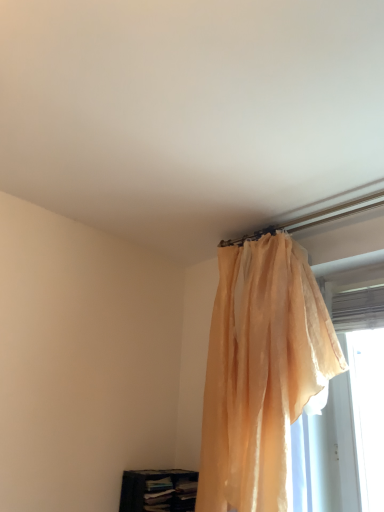
What do you see at coordinates (261, 373) in the screenshot? I see `translucent peach curtain at upper right` at bounding box center [261, 373].

Where is `dark blue fabric bookshelf at lower left`? This screenshot has width=384, height=512. dark blue fabric bookshelf at lower left is located at coordinates (158, 490).

Describe the element at coordinates (158, 490) in the screenshot. I see `dark blue fabric bookshelf at lower left` at that location.

Find the location of `translucent peach curtain at upper right`. translucent peach curtain at upper right is located at coordinates (261, 373).

From the image's perspective, which one is positioned lower, dark blue fabric bookshelf at lower left or translucent peach curtain at upper right?

dark blue fabric bookshelf at lower left is shown below in the image.

Is dark blue fabric bookshelf at lower left in contact with translucent peach curtain at upper right?

No, dark blue fabric bookshelf at lower left is not in contact with translucent peach curtain at upper right.

Is dark blue fabric bookshelf at lower left turned away from translucent peach curtain at upper right?

No, translucent peach curtain at upper right is not at the back of dark blue fabric bookshelf at lower left.

In order to click on furniture located below the translucent peach curtain at upper right (from the image's perspective) in this screenshot , I will do `click(158, 490)`.

Based on the photo, is translucent peach curtain at upper right placed right next to dark blue fabric bookshelf at lower left?

There is a gap between translucent peach curtain at upper right and dark blue fabric bookshelf at lower left.

Does point (241, 253) lie in front of point (190, 510)?

That is False.

Looking at this image, from the image's perspective, which is below, translucent peach curtain at upper right or dark blue fabric bookshelf at lower left?

From the image's view, dark blue fabric bookshelf at lower left is below.

Is translucent fabric at right oriented towards dark blue fabric bookshelf at lower left?

No, translucent fabric at right is not oriented towards dark blue fabric bookshelf at lower left.

Which is correct: translucent fabric at right is inside dark blue fabric bookshelf at lower left, or outside of it?

The correct answer is: outside.

From the image's perspective, is translucent fabric at right beneath dark blue fabric bookshelf at lower left?

Incorrect, from the image's perspective, translucent fabric at right is higher than dark blue fabric bookshelf at lower left.

Is translucent peach curtain at upper right completely or partially inside translucent fabric at right?

Actually, translucent peach curtain at upper right is outside translucent fabric at right.

Between translucent fabric at right and translucent peach curtain at upper right, which one appears on the right side from the viewer's perspective?

From the viewer's perspective, translucent fabric at right appears more on the right side.

Is translucent fabric at right in contact with translucent peach curtain at upper right?

No.

Could you tell me if translucent fabric at right is facing translucent peach curtain at upper right?

No, translucent fabric at right is not aimed at translucent peach curtain at upper right.

Is point (238, 270) positioned in front of point (348, 329)?

Yes, point (238, 270) is closer to viewer.

How many degrees apart are the facing directions of translucent peach curtain at upper right and translucent fabric at right?

2.58 degrees separate the facing orientations of translucent peach curtain at upper right and translucent fabric at right.

Is translucent peach curtain at upper right located outside translucent fabric at right?

translucent peach curtain at upper right lies outside translucent fabric at right's area.

Find the location of a particular element. This screenshot has height=512, width=384. curtain on the left of translucent fabric at right is located at coordinates (261, 373).

Is dark blue fabric bookshelf at lower left spatially inside translucent fabric at right, or outside of it?

dark blue fabric bookshelf at lower left is not inside translucent fabric at right, it's outside.

Who is smaller, dark blue fabric bookshelf at lower left or translucent fabric at right?

Smaller between the two is dark blue fabric bookshelf at lower left.

Are dark blue fabric bookshelf at lower left and translucent fabric at right far apart?

No, dark blue fabric bookshelf at lower left is in close proximity to translucent fabric at right.

Based on the photo, which is less distant, (147,490) or (375,446)?

Point (147,490) appears to be farther away from the viewer than point (375,446).

Locate an element on the screen. Image resolution: width=384 pixels, height=512 pixels. furniture below the translucent peach curtain at upper right (from a real-world perspective) is located at coordinates (158, 490).

The width and height of the screenshot is (384, 512). I want to click on furniture on the left of translucent peach curtain at upper right, so click(158, 490).

Looking at the image, which one is located further to dark blue fabric bookshelf at lower left, translucent fabric at right or translucent peach curtain at upper right?

translucent fabric at right is positioned further to the anchor dark blue fabric bookshelf at lower left.

Based on their spatial positions, is translucent fabric at right or dark blue fabric bookshelf at lower left closer to translucent peach curtain at upper right?

translucent fabric at right lies closer to translucent peach curtain at upper right than the other object.

From the image, which object appears to be nearer to translucent fabric at right, translucent peach curtain at upper right or dark blue fabric bookshelf at lower left?

translucent peach curtain at upper right.

When comparing their distances from dark blue fabric bookshelf at lower left, does translucent peach curtain at upper right or translucent fabric at right seem further?

Among the two, translucent fabric at right is located further to dark blue fabric bookshelf at lower left.

From the image, which object appears to be nearer to translucent fabric at right, dark blue fabric bookshelf at lower left or translucent peach curtain at upper right?

translucent peach curtain at upper right is positioned closer to the anchor translucent fabric at right.

Which object lies further to the anchor point translucent peach curtain at upper right, dark blue fabric bookshelf at lower left or translucent fabric at right?

dark blue fabric bookshelf at lower left lies further to translucent peach curtain at upper right than the other object.

Locate an element on the screen. Image resolution: width=384 pixels, height=512 pixels. curtain between dark blue fabric bookshelf at lower left and translucent fabric at right is located at coordinates (261, 373).